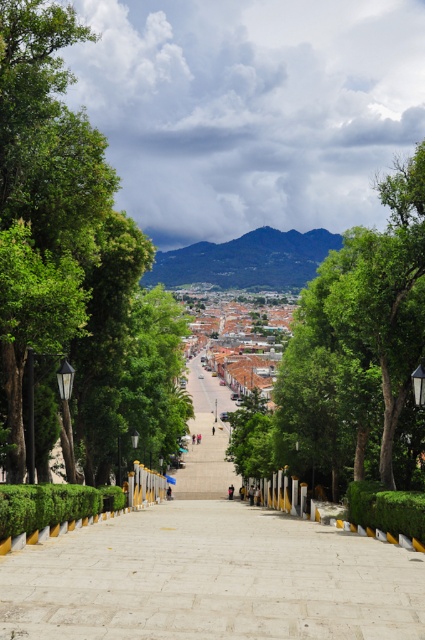
Who is lower down, green leafy tree at upper center or green leafy hedge at center?

Positioned lower is green leafy hedge at center.

Does green leafy tree at upper center appear under green leafy hedge at center?

No.

This screenshot has width=425, height=640. I want to click on green leafy tree at upper center, so click(354, 346).

Does point (275, 451) come farther from viewer compared to point (65, 502)?

Yes, point (275, 451) is farther from viewer.

Is green leafy tree at upper center bigger than green leafy hedge at lower left?

Yes.

Who is more distant from viewer, (x=345, y=416) or (x=33, y=492)?

The point (x=345, y=416) is more distant.

Locate an element on the screen. Image resolution: width=425 pixels, height=640 pixels. green leafy tree at upper center is located at coordinates (354, 346).

Can you confirm if green leafy tree at center is positioned above white stone steps at center?

Correct, green leafy tree at center is located above white stone steps at center.

Find the location of a particular element. Image resolution: width=425 pixels, height=640 pixels. green leafy tree at center is located at coordinates (73, 269).

Locate an element on the screen. green leafy tree at center is located at coordinates (73, 269).